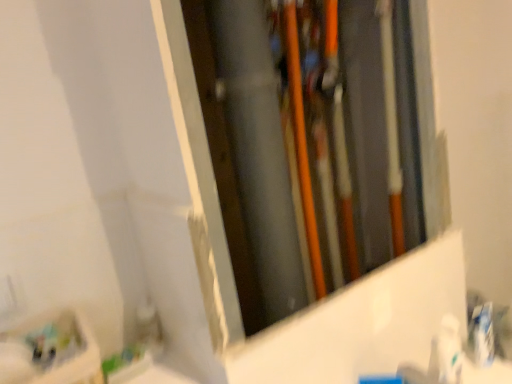
Question: Is white glossy toothpaste at right taller or shorter than white glossy toothpaste at lower right?

Choices:
 (A) tall
 (B) short

Answer: (B)

Question: From a real-world perspective, is white glossy toothpaste at right positioned above or below white glossy toothpaste at lower right?

Choices:
 (A) below
 (B) above

Answer: (A)

Question: Considering their positions, is white glossy toothpaste at right located in front of or behind white glossy toothpaste at lower right?

Choices:
 (A) behind
 (B) front

Answer: (A)

Question: Is white glossy toothpaste at lower right wider or thinner than white glossy toothpaste at right?

Choices:
 (A) wide
 (B) thin

Answer: (A)

Question: Is white glossy toothpaste at lower right taller or shorter than white glossy toothpaste at right?

Choices:
 (A) short
 (B) tall

Answer: (B)

Question: Is point (455, 364) positioned closer to the camera than point (485, 304)?

Choices:
 (A) farther
 (B) closer

Answer: (B)

Question: From a real-world perspective, is white glossy toothpaste at lower right positioned above or below white glossy toothpaste at right?

Choices:
 (A) above
 (B) below

Answer: (A)